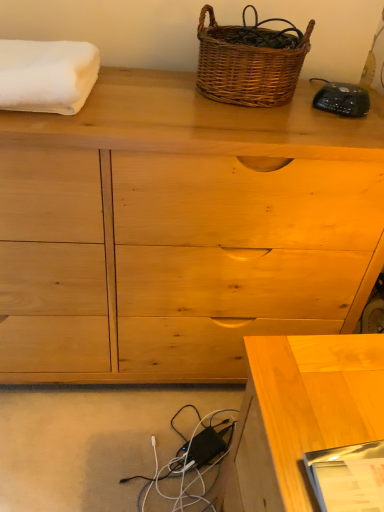
Where is `free space that is to the left of woven brown picnic basket at upper center`? Image resolution: width=384 pixels, height=512 pixels. free space that is to the left of woven brown picnic basket at upper center is located at coordinates (157, 74).